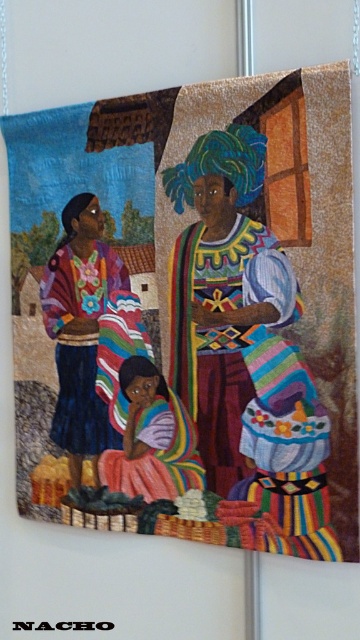
Question: Is matte floral blouse at left above multicolored fabric at center?

Choices:
 (A) yes
 (B) no

Answer: (A)

Question: Which of the following is the farthest from the observer?

Choices:
 (A) (173, 458)
 (B) (109, 260)

Answer: (B)

Question: Among these points, which one is farthest from the camera?

Choices:
 (A) (258, 300)
 (B) (138, 408)
 (C) (62, 339)

Answer: (C)

Question: Can you confirm if matte floral blouse at left is positioned above multicolored fabric at center?

Choices:
 (A) no
 (B) yes

Answer: (B)

Question: Considering the real-world distances, which object is farthest from the multicolored woven fabric at center?

Choices:
 (A) multicolored fabric at center
 (B) matte floral blouse at left

Answer: (B)

Question: Is the position of matte floral blouse at left less distant than that of multicolored fabric at center?

Choices:
 (A) yes
 (B) no

Answer: (B)